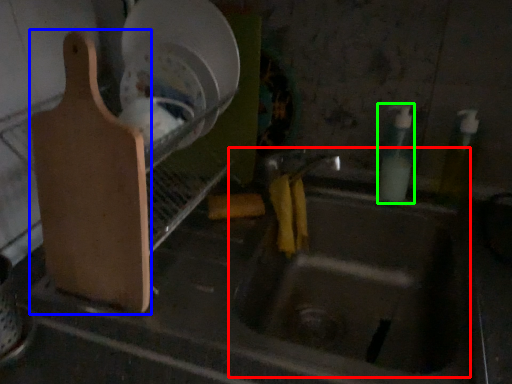
Question: Considering the real-world distances, which object is closest to sink (highlighted by a red box)? cutting board (highlighted by a blue box) or bottle (highlighted by a green box).

Choices:
 (A) cutting board
 (B) bottle

Answer: (B)